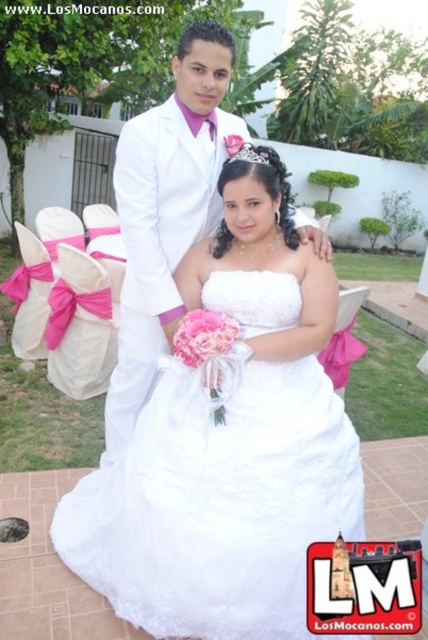
You are a photographer at a wedding and need to capture a photo of the couple. The bride is wearing the white satin dress at center and the groom is in the matte white suit at center. From the photographer perspective, which side of the groom should you focus on to include the bride in the frame?

The white satin dress at center is positioned on the right side of the matte white suit at center, so the photographer should focus on the right side of the groom to include the bride in the frame.

You are a photographer standing at a certain distance from the white satin dress at center. You need to capture a full body shot of the dress without any distortion. The ideal distance for this shot is between 1.5 to 2 meters. Is your current position suitable?

The distance between you and the white satin dress at center is 1.81 meters, which falls within the ideal range of 1.5 to 2 meters. Therefore, your current position is suitable for capturing a full body shot without distortion.